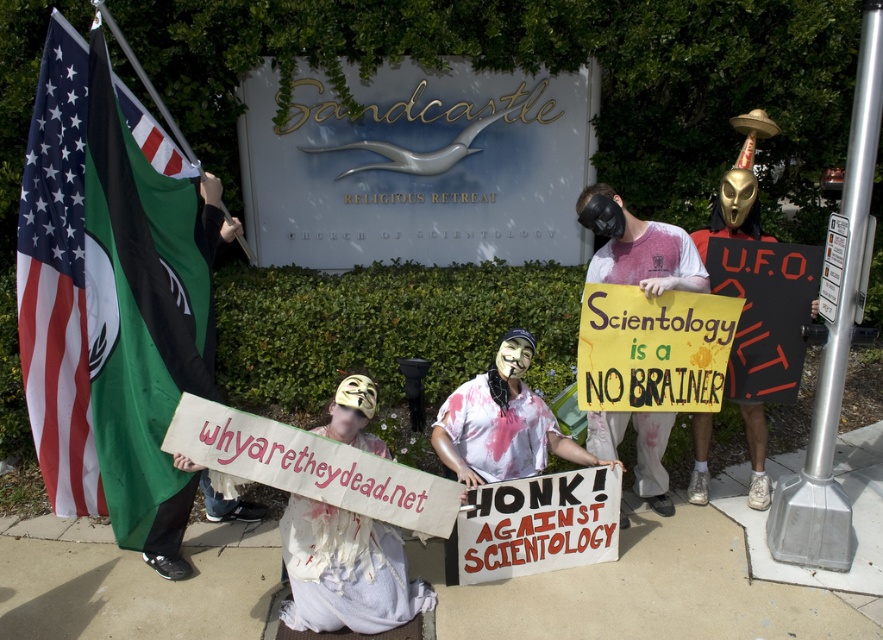
You are a photographer standing at the camera position. You want to take a closeup shot of the sign that says whyaretheydead.net held by the kneeling person. The sign is located at point (340, 582). However, there is a sign held by another protester that is closer to you. Which sign should you focus on to get the best closeup without moving your position?

The point (340, 582) is 10.98 feet away from the camera. Since the other sign is closer, you should focus on the closer sign to get the best closeup without moving.

You are a photographer at the protest scene. You need to capture a clear photo of both the white cloth mask at center and the white paper mask at center. Which mask should you focus on first to ensure it appears larger in the photo?

The white cloth mask at center is taller than the white paper mask at center, so focusing on the white cloth mask at center first will ensure it appears larger in the photo.